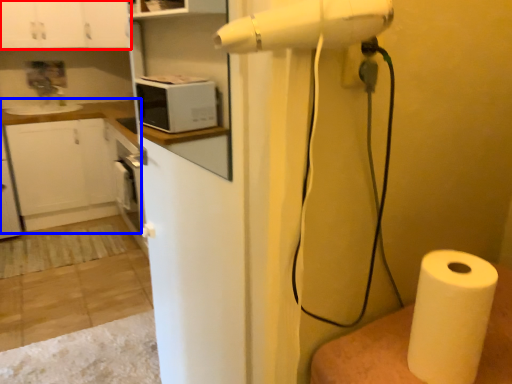
Question: Among these objects, which one is farthest to the camera, cabinetry (highlighted by a red box) or counter top (highlighted by a blue box)?

Choices:
 (A) cabinetry
 (B) counter top

Answer: (B)